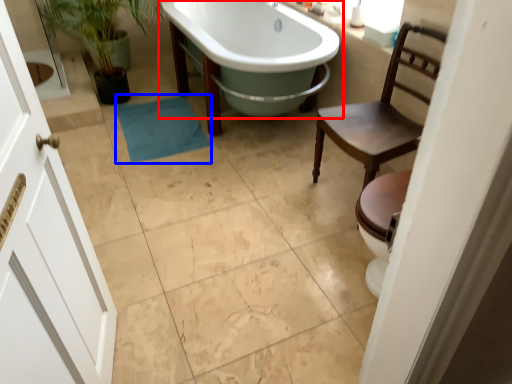
Question: Which point is closer to the camera, bathtub (highlighted by a red box) or bath towel (highlighted by a blue box)?

Choices:
 (A) bathtub
 (B) bath towel

Answer: (A)